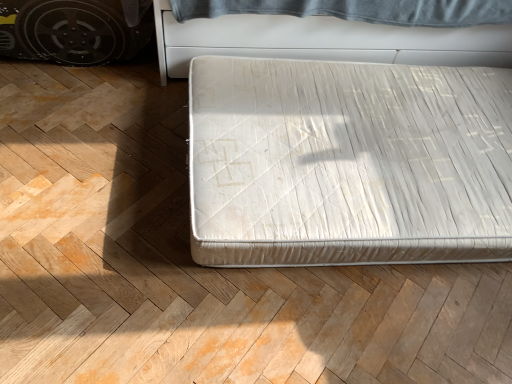
Question: Is white fabric bed at center positioned far away from white fabric mattress at center?

Choices:
 (A) yes
 (B) no

Answer: (B)

Question: Can you confirm if white fabric bed at center is shorter than white fabric mattress at center?

Choices:
 (A) no
 (B) yes

Answer: (B)

Question: From a real-world perspective, does white fabric bed at center sit lower than white fabric mattress at center?

Choices:
 (A) no
 (B) yes

Answer: (B)

Question: Considering the relative sizes of white fabric bed at center and white fabric mattress at center in the image provided, is white fabric bed at center taller than white fabric mattress at center?

Choices:
 (A) no
 (B) yes

Answer: (A)

Question: Does white fabric bed at center have a larger size compared to white fabric mattress at center?

Choices:
 (A) yes
 (B) no

Answer: (B)

Question: Is white fabric bed at center facing towards white fabric mattress at center?

Choices:
 (A) no
 (B) yes

Answer: (A)

Question: Is white fabric mattress at center smaller than white fabric bed at center?

Choices:
 (A) no
 (B) yes

Answer: (A)

Question: Is white fabric mattress at center oriented away from white fabric bed at center?

Choices:
 (A) yes
 (B) no

Answer: (B)

Question: From the image's perspective, is white fabric mattress at center on white fabric bed at center?

Choices:
 (A) no
 (B) yes

Answer: (B)

Question: Could you tell me if white fabric mattress at center is turned towards white fabric bed at center?

Choices:
 (A) no
 (B) yes

Answer: (B)

Question: Does white fabric mattress at center appear on the left side of white fabric bed at center?

Choices:
 (A) no
 (B) yes

Answer: (A)

Question: Can we say white fabric mattress at center lies outside white fabric bed at center?

Choices:
 (A) yes
 (B) no

Answer: (A)

Question: Is white fabric mattress at center spatially inside white fabric bed at center, or outside of it?

Choices:
 (A) inside
 (B) outside

Answer: (B)